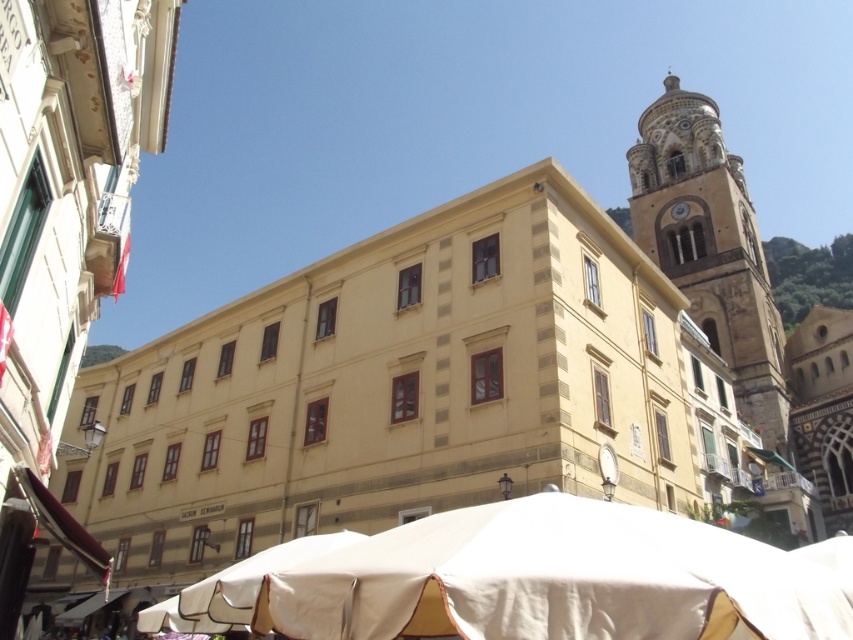
Does white fabric canopy at lower center have a lesser width compared to golden stone bell tower at upper right?

Correct, white fabric canopy at lower center's width is less than golden stone bell tower at upper right's.

The height and width of the screenshot is (640, 853). What do you see at coordinates (544, 579) in the screenshot?
I see `white fabric canopy at lower center` at bounding box center [544, 579].

You are a GUI agent. You are given a task and a screenshot of the screen. Output one action in this format:
    pyautogui.click(x=<x>, y=<y>)
    Task: Click on the white fabric canopy at lower center
    Image resolution: width=853 pixels, height=640 pixels.
    Given the screenshot: What is the action you would take?
    pyautogui.click(x=544, y=579)